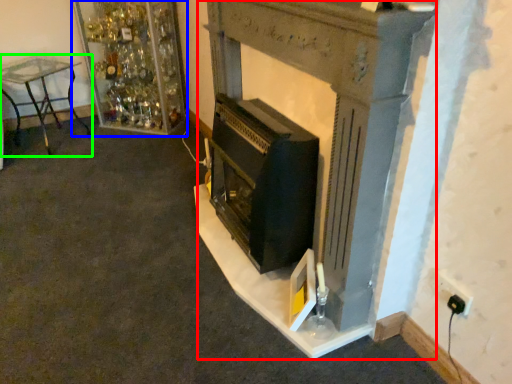
Question: Estimate the real-world distances between objects in this image. Which object is closer to fireplace (highlighted by a red box), shelf (highlighted by a blue box) or furniture (highlighted by a green box)?

Choices:
 (A) shelf
 (B) furniture

Answer: (A)